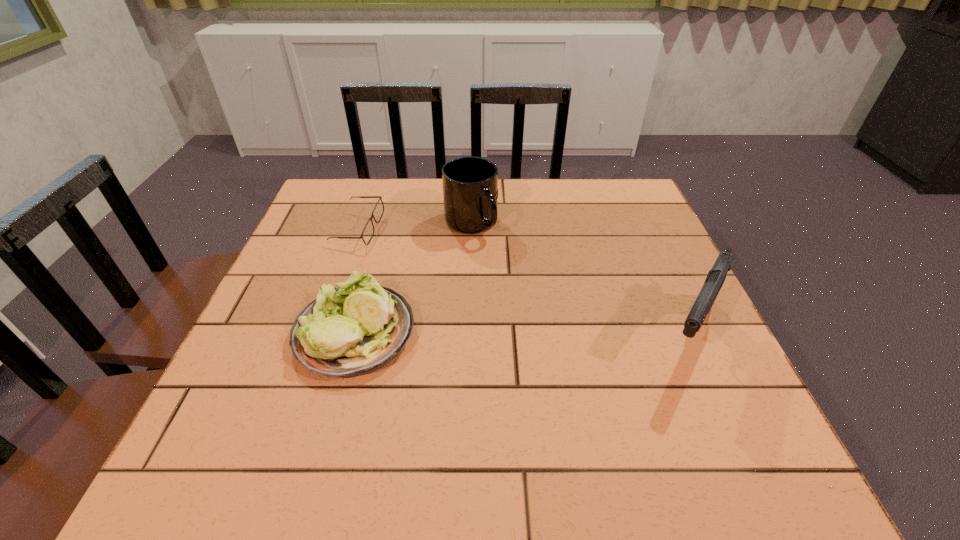
The width and height of the screenshot is (960, 540). In order to click on blank space located 0.150m with the lenses facing outward on the shortest object in this screenshot , I will do `click(417, 264)`.

Locate an element on the screen. free space located with the lenses facing outward on the shortest object is located at coordinates (478, 296).

Where is `mug present at the far edge`? This screenshot has width=960, height=540. mug present at the far edge is located at coordinates (470, 184).

I want to click on spectacles present at the far edge, so click(368, 231).

You are a GUI agent. You are given a task and a screenshot of the screen. Output one action in this format:
    pyautogui.click(x=<x>, y=<y>)
    Task: Click on the lettuce that is at the near edge
    
    Given the screenshot: What is the action you would take?
    pos(353,330)

Find the location of a particular element. The width and height of the screenshot is (960, 540). gun located at the near edge is located at coordinates (716, 276).

At what (x,y) coordinates should I click in order to perform the action: click on lettuce situated at the left edge. Please return your answer as a coordinate pair (x, y). The height and width of the screenshot is (540, 960). Looking at the image, I should click on (353, 330).

In order to click on spectacles at the left edge in this screenshot , I will do `click(368, 231)`.

Where is `object present at the right edge`? Image resolution: width=960 pixels, height=540 pixels. object present at the right edge is located at coordinates (716, 276).

Locate an element on the screen. object positioned at the far left corner is located at coordinates (368, 231).